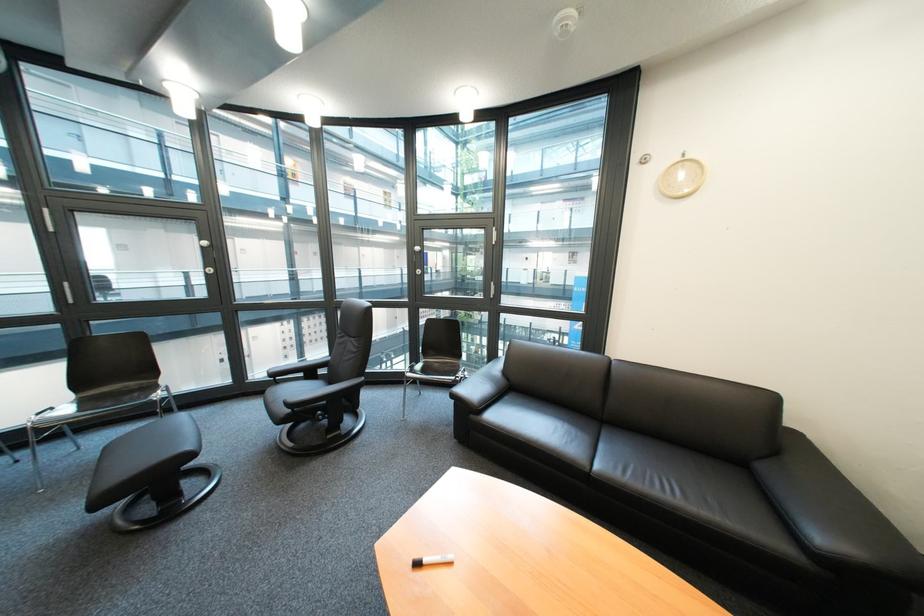
What do you see at coordinates (639, 464) in the screenshot?
I see `the sofa sitting surface` at bounding box center [639, 464].